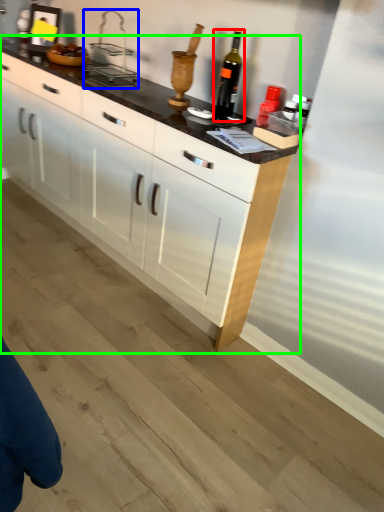
Question: Considering the real-world distances, which object is closest to wine bottle (highlighted by a red box)? appliance (highlighted by a blue box) or cabinetry (highlighted by a green box).

Choices:
 (A) appliance
 (B) cabinetry

Answer: (A)